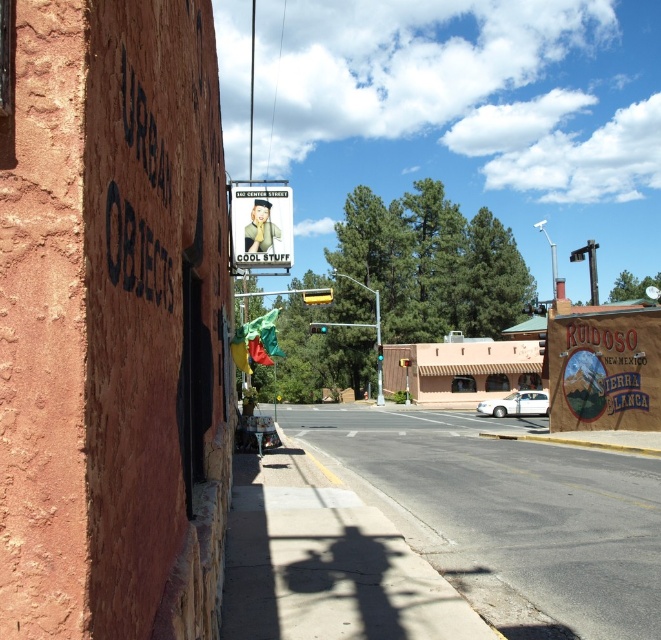
Question: From the image, what is the correct spatial relationship of matte brown signboard at right in relation to matte plastic sign at upper center?

Choices:
 (A) below
 (B) above

Answer: (A)

Question: Which of the following is the farthest from the observer?

Choices:
 (A) matte plastic sign at upper center
 (B) matte brown signboard at right

Answer: (B)

Question: Considering the relative positions of matte brown signboard at right and matte plastic sign at upper center in the image provided, where is matte brown signboard at right located with respect to matte plastic sign at upper center?

Choices:
 (A) right
 (B) left

Answer: (A)

Question: Is matte brown signboard at right positioned behind matte plastic sign at upper center?

Choices:
 (A) no
 (B) yes

Answer: (B)

Question: Among these objects, which one is nearest to the camera?

Choices:
 (A) matte brown signboard at right
 (B) matte plastic sign at upper center

Answer: (B)